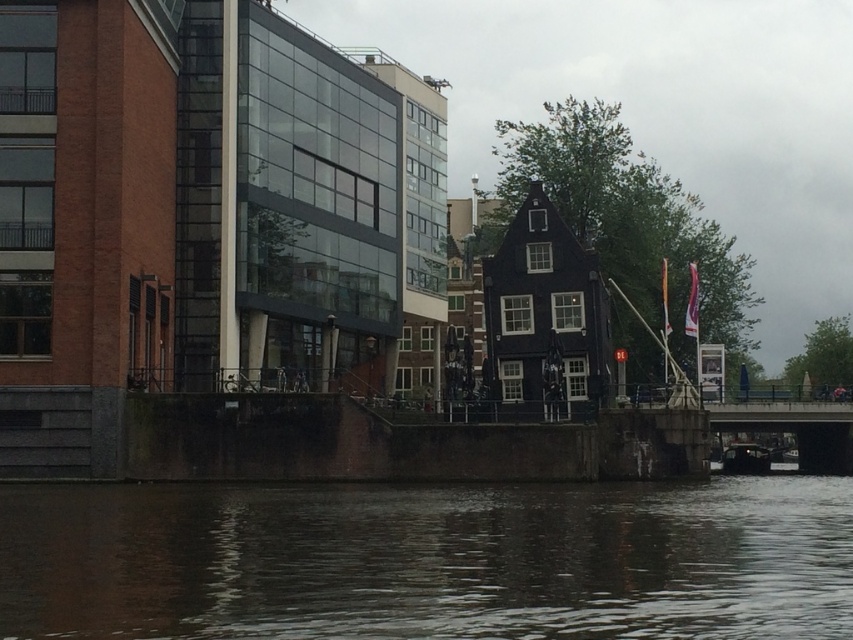
You are standing at the canal edge and want to throw a stone into the brown water at lower center. If your throwing distance is 25 meters, will you be able to reach it?

The brown water at lower center is 26.43 meters away from the viewer, so you cannot reach it with a 25 meters throw.

You are a tour guide leading a group along the canal. You want to point out both the brown water at lower center and the dark brown wooden boat at lower right. How far apart are these two landmarks from each other?

The brown water at lower center and the dark brown wooden boat at lower right are 63.05 meters apart from each other.

You are standing at the edge of the canal in the image. There is a point marked at coordinates point (x=447, y=564). Can you safely walk to that point without getting too close to the water?

The point (x=447, y=564) is 133.39 feet away from the viewer. Since it is quite far from the current position, you can safely walk to that point without getting too close to the water.